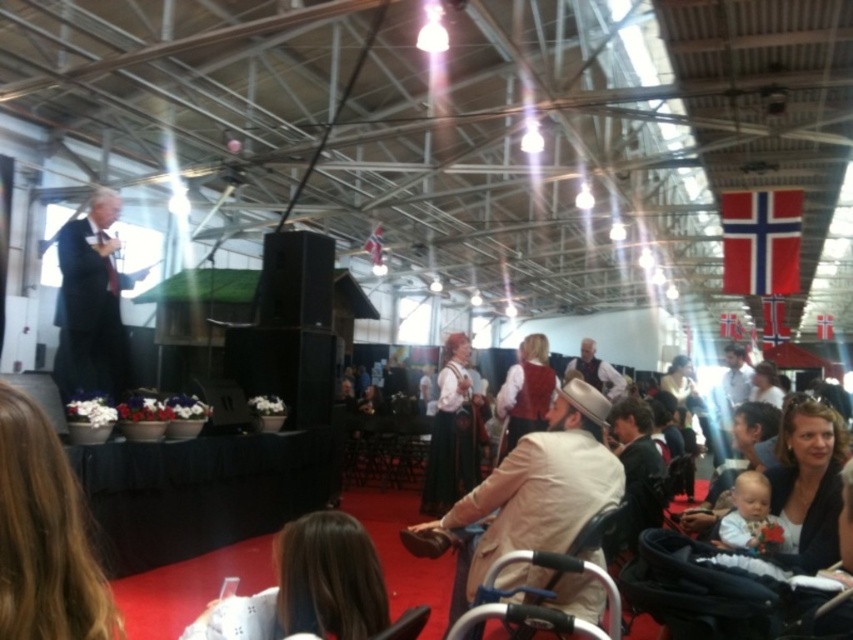
You are standing at the center of the venue and want to retrieve your matte black jacket at lower right. According to the coordinates provided, in which direction should you move from your current position to reach it?

The matte black jacket at lower right is located at coordinates point (807, 483). Since you are at the center, you should move towards the lower right direction to reach it.

You are a photographer at the event and want to capture a photo of both the brown hair at lower center and the black plastic baby carriage at lower center in the same frame. Considering their sizes, which one might appear smaller in the final photo?

The brown hair at lower center is smaller than the black plastic baby carriage at lower center, so it will appear smaller in the photo.

You are a photographer positioned at the back of the venue and need to capture a clear shot of both the dark suit at left and the matte white blouse at center. Which person should you focus on first to ensure both are in frame?

You should focus on the matte white blouse at center first because the dark suit at left is shorter than the matte white blouse at center, so adjusting the camera angle to include the taller matte white blouse at center will naturally include the shorter dark suit at left in the frame.